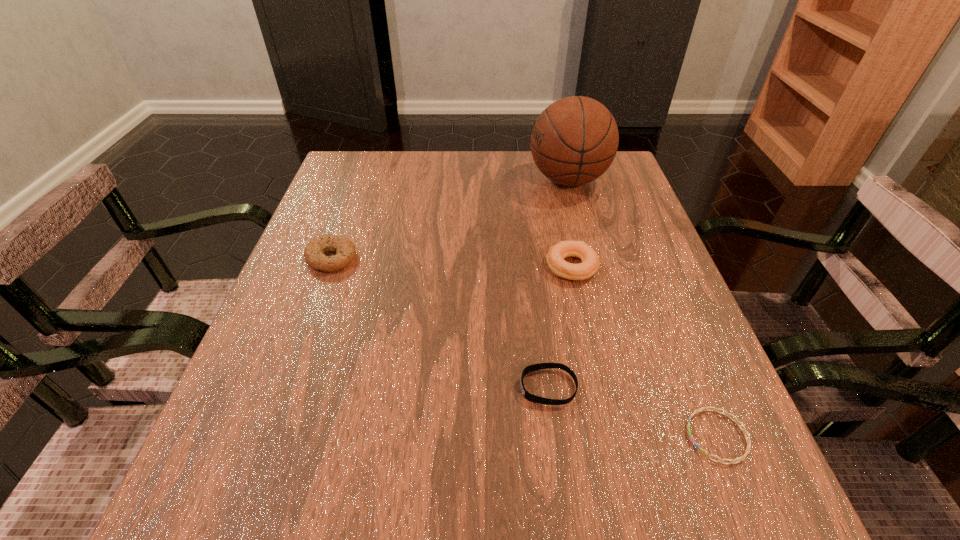
Find the location of a particular element. The width and height of the screenshot is (960, 540). object present at the left edge is located at coordinates (344, 248).

Locate an element on the screen. The width and height of the screenshot is (960, 540). basketball located in the right edge section of the desktop is located at coordinates (575, 139).

Where is `bagel that is positioned at the right edge`? bagel that is positioned at the right edge is located at coordinates (590, 263).

Where is `bracelet positioned at the right edge`? The height and width of the screenshot is (540, 960). bracelet positioned at the right edge is located at coordinates (726, 413).

The width and height of the screenshot is (960, 540). I want to click on object located in the far right corner section of the desktop, so click(x=575, y=139).

In the image, there is a desktop. Identify the location of blank space at the far edge. This screenshot has height=540, width=960. (400, 172).

Identify the location of vacant region at the near edge. (324, 522).

Where is `vacant area at the left edge of the desktop`? The width and height of the screenshot is (960, 540). vacant area at the left edge of the desktop is located at coordinates (344, 224).

The image size is (960, 540). What are the coordinates of `vacant space at the right edge of the desktop` in the screenshot? It's located at (654, 468).

At what (x,y) coordinates should I click in order to perform the action: click on free region at the far left corner. Please return your answer as a coordinate pair (x, y). This screenshot has width=960, height=540. Looking at the image, I should click on (384, 181).